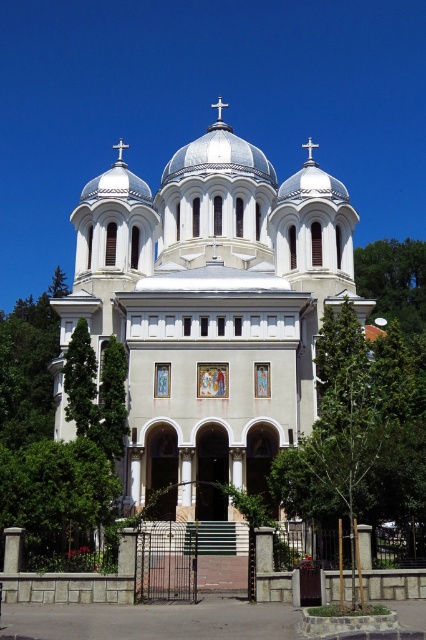
Can you confirm if green leafy tree at upper right is smaller than white glossy dome at center?

Yes.

Is green leafy tree at upper right taller than white glossy dome at center?

No, green leafy tree at upper right is not taller than white glossy dome at center.

Which is in front, point (422, 321) or point (166, 172)?

Point (166, 172) is in front.

You are a GUI agent. You are given a task and a screenshot of the screen. Output one action in this format:
    pyautogui.click(x=<x>, y=<y>)
    Task: Click on the green leafy tree at upper right
    Image resolution: width=426 pixels, height=640 pixels.
    Given the screenshot: What is the action you would take?
    pyautogui.click(x=394, y=280)

Does white smooth church at center have a lesser height compared to green leafy tree at left?

No.

Does point (255, 176) come behind point (80, 408)?

Yes, it is.

Which is behind, point (161, 465) or point (85, 324)?

Positioned behind is point (161, 465).

Find the location of a particular element. The width and height of the screenshot is (426, 640). white smooth church at center is located at coordinates (212, 308).

Can you confirm if green leafy tree at lower left is taller than green leafy tree at left?

In fact, green leafy tree at lower left may be shorter than green leafy tree at left.

Where is `green leafy tree at lower left`? green leafy tree at lower left is located at coordinates (55, 492).

Who is more distant from viewer, (43, 508) or (81, 364)?

The point (81, 364) is more distant.

Where is `green leafy tree at lower left`? The image size is (426, 640). green leafy tree at lower left is located at coordinates (55, 492).